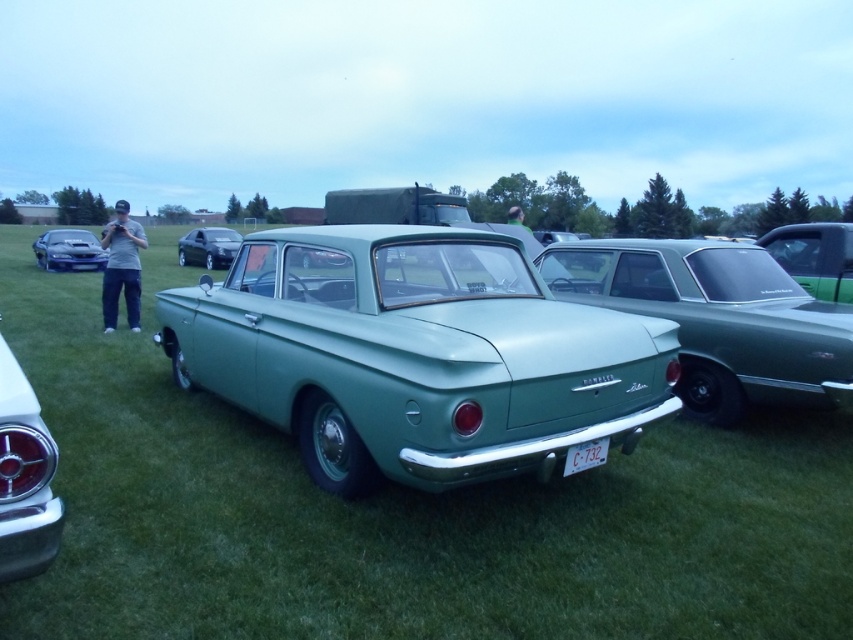
You are a photographer at the classic car event. You want to capture a clear photo of the white plastic license plate at center without the green matte sedan at center blocking it. Is this possible?

The green matte sedan at center is positioned over the white plastic license plate at center, so it is blocking the license plate. Therefore, it is not possible to capture a clear photo of the white plastic license plate at center without the green matte sedan at center blocking it.

You are a photographer at the classic car event. You want to capture a photo of the satin black car at center and the white plastic license plate at center. Based on their positions, which object is located to the left of the other?

The satin black car at center is positioned on the left side of white plastic license plate at center.

You are a photographer standing at the camera position. You want to take a photo of the matte green car at center. Is the distance between you and the car sufficient to capture a clear, full view of the car without moving closer?

The distance between the matte green car at center and the camera is 2.98 meters. This distance is sufficient for capturing a clear, full view of the car without needing to move closer, as modern cameras can effectively focus and frame subjects at this range.